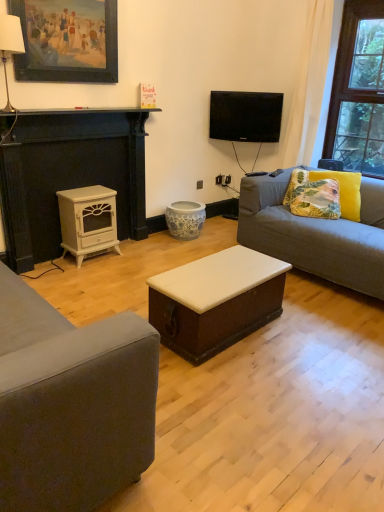
Where is `white painted wood fireplace at left`? This screenshot has width=384, height=512. white painted wood fireplace at left is located at coordinates (69, 175).

Image resolution: width=384 pixels, height=512 pixels. What do you see at coordinates (10, 46) in the screenshot?
I see `white fabric lampshade at upper left` at bounding box center [10, 46].

Describe the element at coordinates (245, 116) in the screenshot. I see `black glossy tv at upper center` at that location.

Describe the element at coordinates (216, 301) in the screenshot. I see `white painted wood trunk at center, marked as the first table in a front-to-back arrangement` at that location.

Find the location of a particular element. The width and height of the screenshot is (384, 512). white painted wood fireplace at left is located at coordinates (69, 175).

Find the location of `the 2nd pillow positioned above the white painted wood trunk at center, marked as the first table in a front-to-back arrangement (from the image's perspective)`. the 2nd pillow positioned above the white painted wood trunk at center, marked as the first table in a front-to-back arrangement (from the image's perspective) is located at coordinates (312, 196).

Is floral fabric cushion at right, the second pillow positioned from the right, at the right side of white painted wood trunk at center, which appears as the 2th table when viewed from the left?

Yes.

From the image's perspective, is floral fabric cushion at right, the second pillow positioned from the right, above or below white painted wood trunk at center, marked as the first table in a front-to-back arrangement?

Based on their image positions, floral fabric cushion at right, the second pillow positioned from the right, is located above white painted wood trunk at center, marked as the first table in a front-to-back arrangement.

Between point (83, 234) and point (8, 181), which one is positioned in front?

The point (8, 181) is closer to the camera.

Is white painted wood stove at left, which is counted as the 1th table, starting from the left, shorter than white painted wood fireplace at left?

Indeed, white painted wood stove at left, which is counted as the 1th table, starting from the left, has a lesser height compared to white painted wood fireplace at left.

Looking at this image, from a real-world perspective, who is located higher, white painted wood stove at left, the first table when ordered from top to bottom, or white painted wood fireplace at left?

white painted wood fireplace at left is physically above.

Are white painted wood stove at left, which is counted as the 1th table, starting from the left, and white painted wood fireplace at left beside each other?

No, white painted wood stove at left, which is counted as the 1th table, starting from the left, is not beside white painted wood fireplace at left.

Between white painted wood fireplace at left and gray fabric couch at right, which one is positioned behind?

white painted wood fireplace at left is further from the camera.

You are a GUI agent. You are given a task and a screenshot of the screen. Output one action in this format:
    pyautogui.click(x=<x>, y=<y>)
    Task: Click on the studio couch located below the white painted wood fireplace at left (from the image's perspective)
    
    Given the screenshot: What is the action you would take?
    pyautogui.click(x=316, y=234)

Is white painted wood fireplace at left not inside gray fabric couch at right?

white painted wood fireplace at left lies outside gray fabric couch at right's area.

Which object is positioned more to the left, white fabric lampshade at upper left or white painted wood trunk at center, the second table from the top?

white fabric lampshade at upper left.

Does white fabric lampshade at upper left lie in front of white painted wood trunk at center, which is the first table from right to left?

No, white fabric lampshade at upper left is further to the viewer.

Which object is wider, white fabric lampshade at upper left or white painted wood trunk at center, the second table from the top?

white painted wood trunk at center, the second table from the top.

From the image's perspective, is white painted wood stove at left, which is counted as the first table, starting from the back, located beneath gray fabric couch at right?

No, from the image's perspective, white painted wood stove at left, which is counted as the first table, starting from the back, is not below gray fabric couch at right.

In the scene shown: In the image, is white painted wood stove at left, which is counted as the first table, starting from the back, positioned in front of or behind gray fabric couch at right?

Clearly, white painted wood stove at left, which is counted as the first table, starting from the back, is behind gray fabric couch at right.

Who is smaller, white painted wood stove at left, the first table when ordered from top to bottom, or gray fabric couch at right?

white painted wood stove at left, the first table when ordered from top to bottom.

Considering the positions of point (226, 336) and point (228, 116), is point (226, 336) closer or farther from the camera than point (228, 116)?

Clearly, point (226, 336) is closer to the camera than point (228, 116).

Which object is positioned more to the right, white painted wood trunk at center, marked as the first table in a front-to-back arrangement, or black glossy tv at upper center?

black glossy tv at upper center is more to the right.

Is white painted wood trunk at center, marked as the 2th table in a back-to-front arrangement, positioned beyond the bounds of black glossy tv at upper center?

Yes, white painted wood trunk at center, marked as the 2th table in a back-to-front arrangement, is outside of black glossy tv at upper center.

Considering the sizes of objects white painted wood trunk at center, which is counted as the 1th table, starting from the bottom, and black glossy tv at upper center in the image provided, who is bigger, white painted wood trunk at center, which is counted as the 1th table, starting from the bottom, or black glossy tv at upper center?

white painted wood trunk at center, which is counted as the 1th table, starting from the bottom.

Based on the photo, could you tell me if white painted wood stove at left, which is counted as the 1th table, starting from the left, is facing white painted wood trunk at center, marked as the first table in a front-to-back arrangement?

Yes, white painted wood stove at left, which is counted as the 1th table, starting from the left, is facing white painted wood trunk at center, marked as the first table in a front-to-back arrangement.

Find the location of a particular element. Image resolution: width=384 pixels, height=512 pixels. table in front of the white painted wood stove at left, the first table when ordered from top to bottom is located at coordinates (x=216, y=301).

What's the angular difference between white painted wood stove at left, which is counted as the first table, starting from the back, and white painted wood trunk at center, the second table from the top,'s facing directions?

white painted wood stove at left, which is counted as the first table, starting from the back, and white painted wood trunk at center, the second table from the top, are facing 180 degrees away from each other.

Considering the relative sizes of white painted wood stove at left, the 2th table in the front-to-back sequence, and white painted wood trunk at center, which is the first table from right to left, in the image provided, is white painted wood stove at left, the 2th table in the front-to-back sequence, taller than white painted wood trunk at center, which is the first table from right to left,?

Correct, white painted wood stove at left, the 2th table in the front-to-back sequence, is much taller as white painted wood trunk at center, which is the first table from right to left.

This screenshot has height=512, width=384. In order to click on pillow that is the 2nd object located above the white painted wood trunk at center, which is counted as the 1th table, starting from the bottom (from the image's perspective) in this screenshot , I will do `click(312, 196)`.

Identify the location of fireplace in front of the white painted wood stove at left, which is counted as the 1th table, starting from the left. This screenshot has height=512, width=384. (69, 175).

When comparing their distances from white painted wood fireplace at left, does floral fabric cushion at right, which ranks as the 1th pillow in right-to-left order, or white painted wood stove at left, which is counted as the first table, starting from the back, seem closer?

The object closer to white painted wood fireplace at left is white painted wood stove at left, which is counted as the first table, starting from the back.

When comparing their distances from white painted wood fireplace at left, does white painted wood stove at left, placed as the 2th table when sorted from right to left, or black glossy tv at upper center seem further?

black glossy tv at upper center.

Considering their positions, is floral fabric cushion at right, which ranks as the 1th pillow in right-to-left order, positioned further to gray fabric couch at right than white painted wood trunk at center, marked as the first table in a front-to-back arrangement?

The object further to gray fabric couch at right is white painted wood trunk at center, marked as the first table in a front-to-back arrangement.

When comparing their distances from floral fabric cushion at right, marked as the 2th pillow in a left-to-right arrangement, does white painted wood stove at left, placed as the second table when sorted from bottom to top, or white painted wood fireplace at left seem closer?

Based on the image, white painted wood stove at left, placed as the second table when sorted from bottom to top, appears to be nearer to floral fabric cushion at right, marked as the 2th pillow in a left-to-right arrangement.

Estimate the real-world distances between objects in this image. Which object is further from white painted wood stove at left, the 2th table in the front-to-back sequence, floral fabric cushion at right, marked as the 2th pillow in a left-to-right arrangement, or wooden picture frame at upper left?

Among the two, floral fabric cushion at right, marked as the 2th pillow in a left-to-right arrangement, is located further to white painted wood stove at left, the 2th table in the front-to-back sequence.

From the image, which object appears to be farther from gray fabric couch at right, floral fabric cushion at right, marked as the 2th pillow in a left-to-right arrangement, or white painted wood fireplace at left?

white painted wood fireplace at left lies further to gray fabric couch at right than the other object.

Estimate the real-world distances between objects in this image. Which object is further from gray fabric couch at right, wooden picture frame at upper left or floral fabric cushion at right, which ranks as the 1th pillow in right-to-left order?

wooden picture frame at upper left is positioned further to the anchor gray fabric couch at right.

Which object lies further to the anchor point black glossy tv at upper center, floral fabric cushion at right, which ranks as the 1th pillow in right-to-left order, or wooden picture frame at upper left?

wooden picture frame at upper left is further to black glossy tv at upper center.

This screenshot has width=384, height=512. I want to click on fireplace between white fabric lampshade at upper left and black glossy tv at upper center, so click(69, 175).

At what (x,y) coordinates should I click in order to perform the action: click on fireplace between white fabric lampshade at upper left and white painted wood stove at left, placed as the second table when sorted from bottom to top, in the up-down direction. Please return your answer as a coordinate pair (x, y). This screenshot has height=512, width=384. Looking at the image, I should click on (69, 175).

What are the coordinates of `pillow between white fabric lampshade at upper left and gray fabric couch at right` in the screenshot? It's located at (312, 196).

Where is `television between white fabric lampshade at upper left and gray fabric couch at right in the horizontal direction`? This screenshot has height=512, width=384. television between white fabric lampshade at upper left and gray fabric couch at right in the horizontal direction is located at coordinates (245, 116).